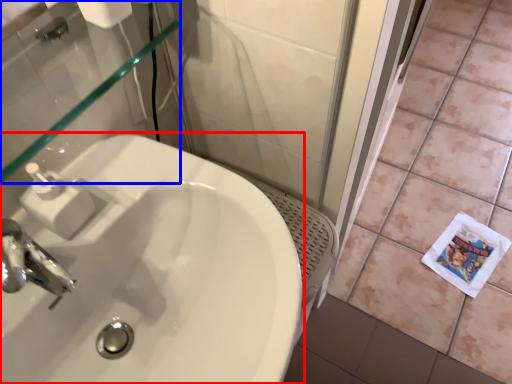
Question: Which point is further to the camera, sink (highlighted by a red box) or mirror (highlighted by a blue box)?

Choices:
 (A) sink
 (B) mirror

Answer: (B)